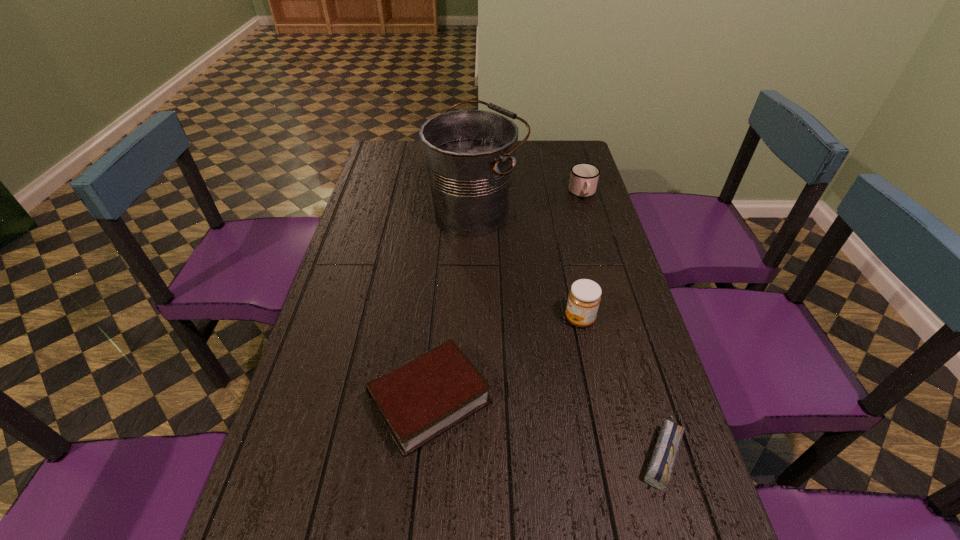
Locate an element on the screen. the tallest object is located at coordinates (469, 155).

Find the location of a particular element. Image resolution: width=960 pixels, height=540 pixels. the fourth shortest object is located at coordinates (584, 298).

You are a GUI agent. You are given a task and a screenshot of the screen. Output one action in this format:
    pyautogui.click(x=<x>, y=<y>)
    Task: Click on the third object from right to left
    
    Given the screenshot: What is the action you would take?
    pyautogui.click(x=584, y=298)

Locate an element on the screen. The image size is (960, 540). the third tallest object is located at coordinates (584, 177).

Find the location of a particular element. This screenshot has height=540, width=960. Bible is located at coordinates (419, 400).

This screenshot has height=540, width=960. Find the location of `the shortest object`. the shortest object is located at coordinates [659, 470].

Where is `vacant space situated 0.060m on the left of the bucket`? vacant space situated 0.060m on the left of the bucket is located at coordinates (411, 212).

I want to click on vacant region located on the front label of the fourth shortest object, so click(x=494, y=319).

Find the location of a particular element. vacant region located on the front label of the fourth shortest object is located at coordinates (444, 319).

Find the location of a particular element. The height and width of the screenshot is (540, 960). vacant space situated on the front label of the fourth shortest object is located at coordinates (484, 319).